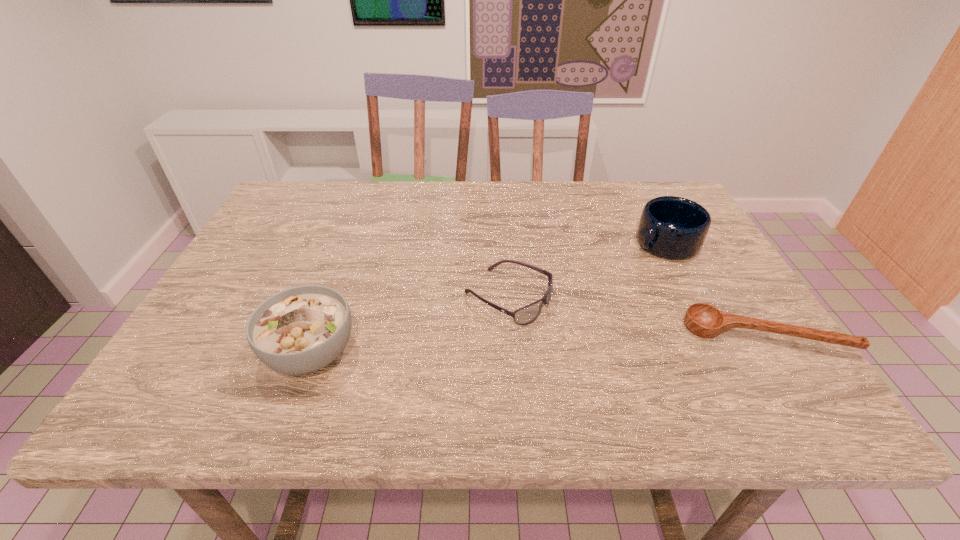
Where is `the leftmost object`? Image resolution: width=960 pixels, height=540 pixels. the leftmost object is located at coordinates (299, 330).

Identify the location of the shortest object. (704, 320).

Locate an element on the screen. The width and height of the screenshot is (960, 540). sunglasses is located at coordinates (523, 316).

Where is `the second object from left to right`? the second object from left to right is located at coordinates (523, 316).

I want to click on mug, so click(x=675, y=228).

This screenshot has width=960, height=540. What are the coordinates of `free region located on the back of the soup bowl` in the screenshot? It's located at (358, 225).

I want to click on vacant space situated 0.060m on the back of the shortest object, so click(x=738, y=295).

This screenshot has width=960, height=540. In order to click on vacant area located on the lenses of the second object from left to right in this screenshot , I will do `click(612, 346)`.

Where is `vacant space located on the lenses of the second object from left to right`? vacant space located on the lenses of the second object from left to right is located at coordinates (666, 371).

This screenshot has width=960, height=540. Find the location of `vacant space located on the lenses of the second object from left to right`. vacant space located on the lenses of the second object from left to right is located at coordinates (598, 339).